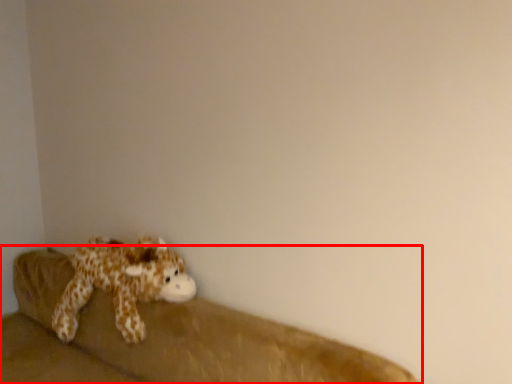
Question: From the image's perspective, where is studio couch (annotated by the red box) located in relation to toy in the image?

Choices:
 (A) below
 (B) above

Answer: (A)